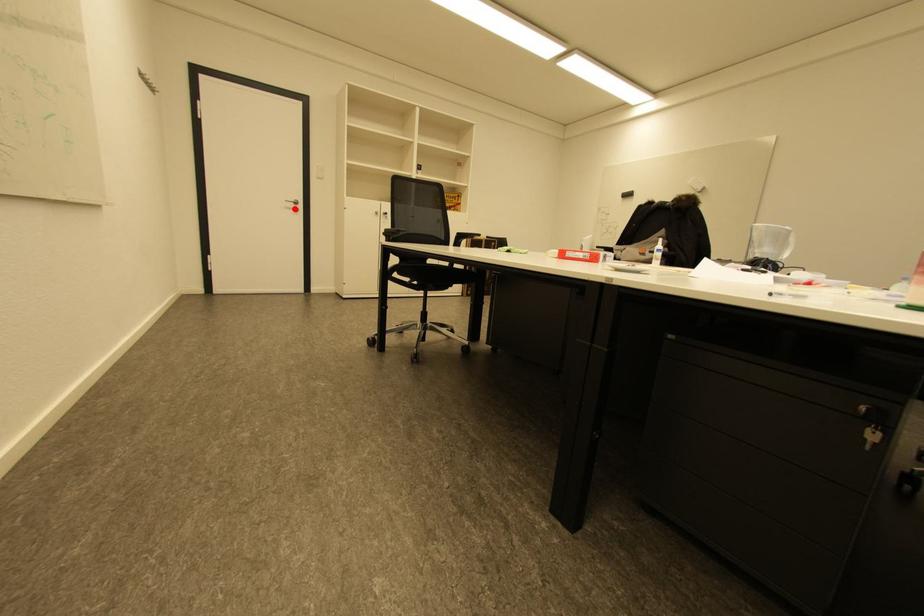
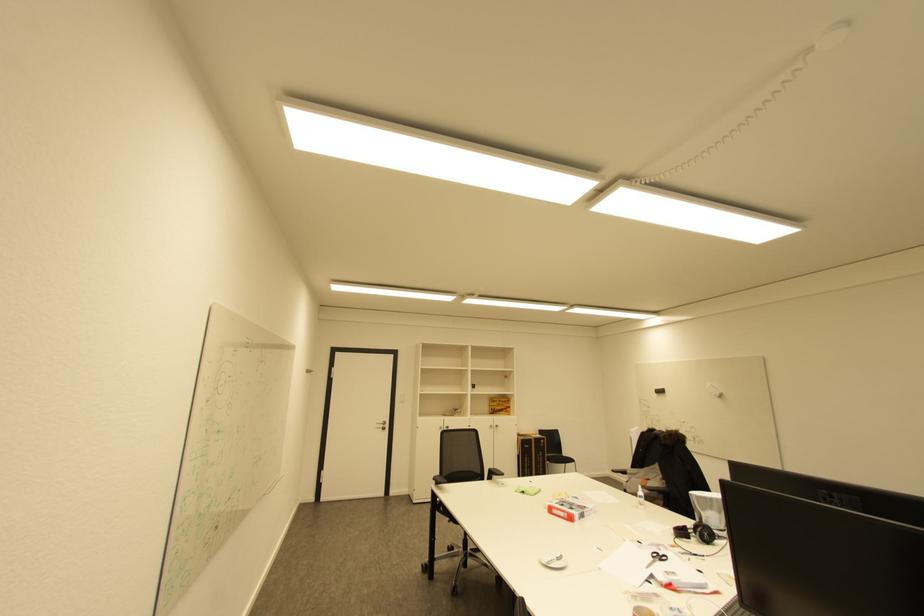
Question: I am providing you with two images of the same scene from different viewpoints. A red point is shown in image1. For the corresponding object point in image2, is it positioned nearer or farther from the camera?

Choices:
 (A) Nearer
 (B) Farther

Answer: (B)